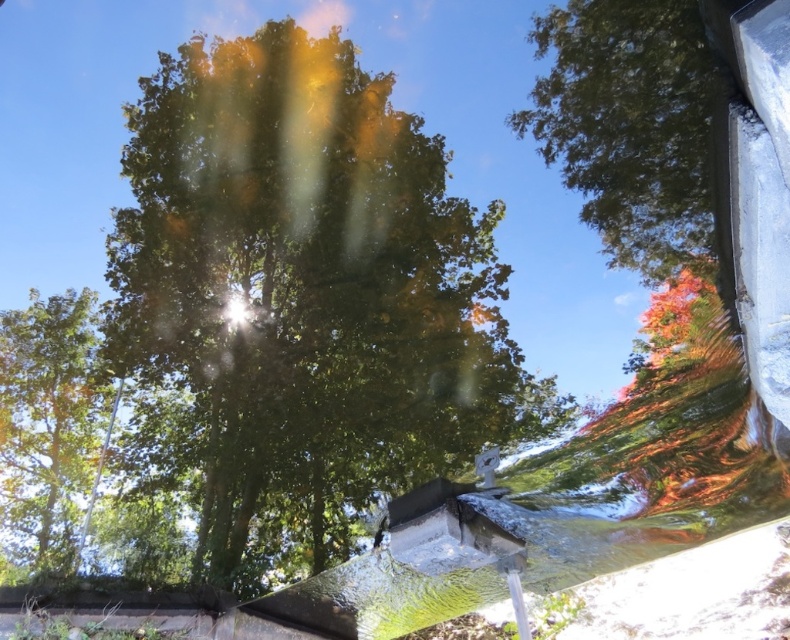
You are standing in front of a car window that reflects the scene. You want to know how far the green leafy tree at center is from you. Can you determine the distance?

The green leafy tree at center is 9.99 feet away from the camera, so it is approximately 10 feet away from you.

You are standing in the scene and want to take a photo of the green leafy tree at upper right and the green leafy tree at left. Which tree should you point your camera at first if you want to capture both in one frame without moving the camera?

You should point your camera at the green leafy tree at upper right first because it is positioned above the green leafy tree at left, so by centering the upper tree, the lower one will naturally be included in the frame.